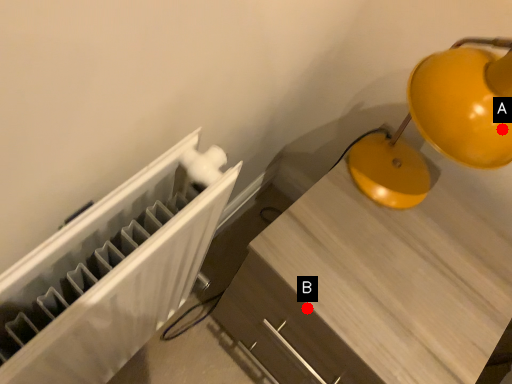
Question: Two points are circled on the image, labeled by A and B beside each circle. Which point is closer to the camera?

Choices:
 (A) A is closer
 (B) B is closer

Answer: (A)